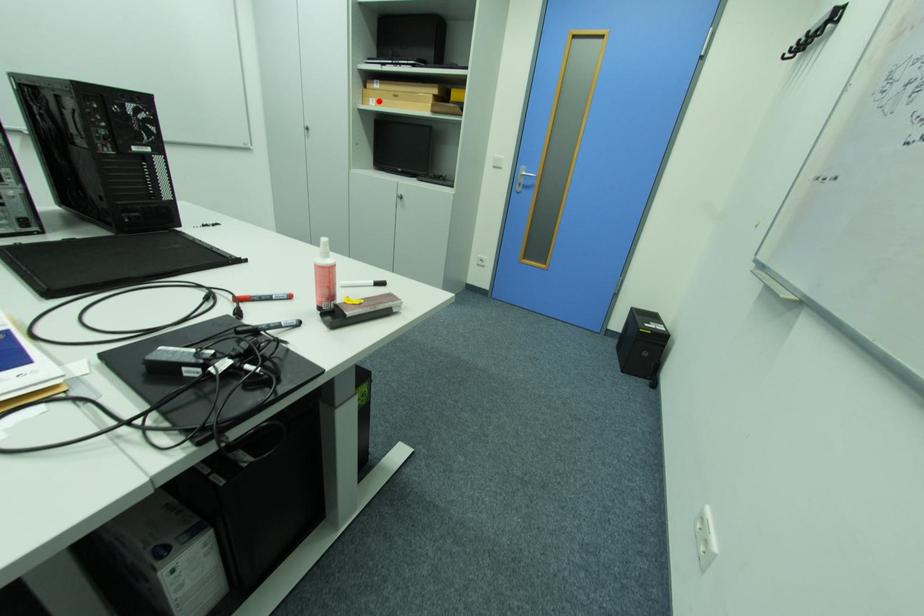
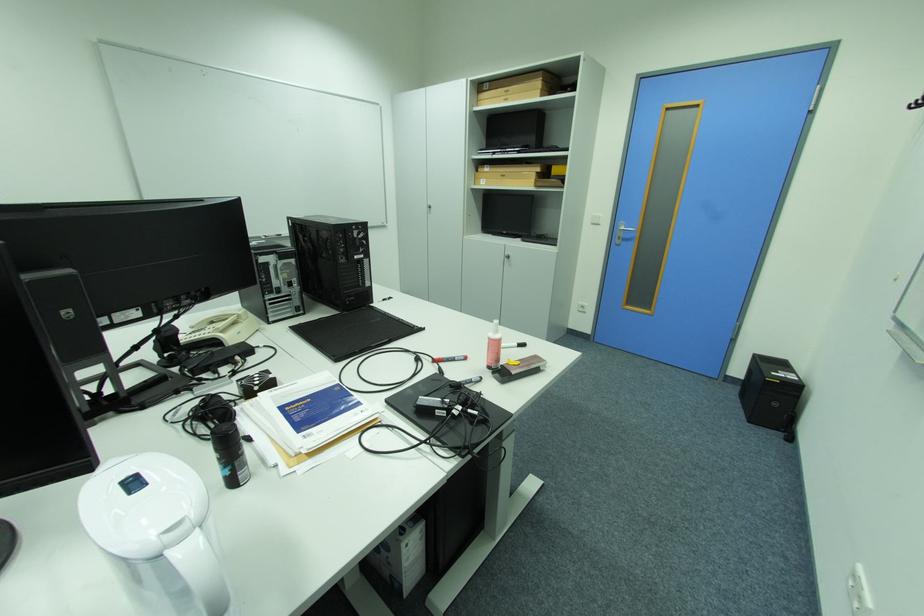
Question: I am providing you with two images of the same scene from different viewpoints. A red point is shown in image1. For the corresponding object point in image2, is it positioned nearer or farther from the camera?

Choices:
 (A) Nearer
 (B) Farther

Answer: (A)